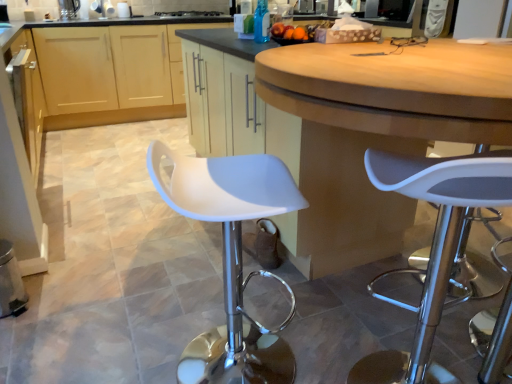
Locate an element on the screen. Image resolution: width=512 pixels, height=384 pixels. vacant space behind white plastic stool at center is located at coordinates (371, 324).